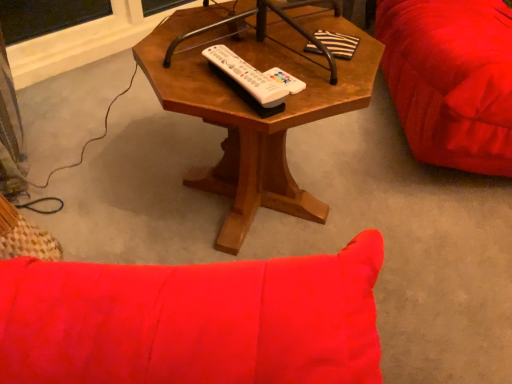
This screenshot has width=512, height=384. Identify the location of vacant position to the left of white plastic remote at center. (181, 74).